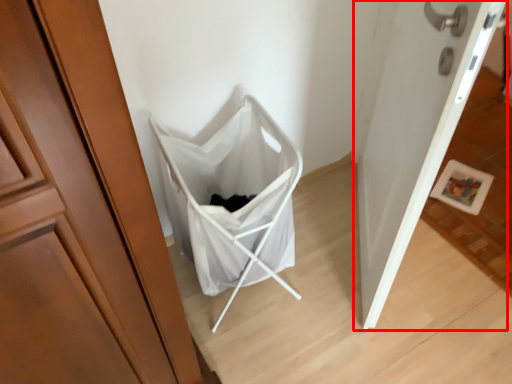
Question: From the image's perspective, where is door (annotated by the red box) located in relation to baby carriage in the image?

Choices:
 (A) below
 (B) above

Answer: (B)